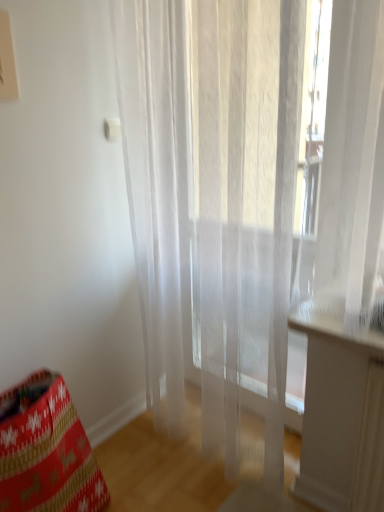
Question: Is red knit bean bag chair at lower left to the left of transparent fabric curtain at center from the viewer's perspective?

Choices:
 (A) yes
 (B) no

Answer: (A)

Question: Considering the relative sizes of red knit bean bag chair at lower left and transparent fabric curtain at center in the image provided, is red knit bean bag chair at lower left wider than transparent fabric curtain at center?

Choices:
 (A) yes
 (B) no

Answer: (A)

Question: Considering the relative sizes of red knit bean bag chair at lower left and transparent fabric curtain at center in the image provided, is red knit bean bag chair at lower left taller than transparent fabric curtain at center?

Choices:
 (A) no
 (B) yes

Answer: (A)

Question: Does red knit bean bag chair at lower left contain transparent fabric curtain at center?

Choices:
 (A) yes
 (B) no

Answer: (B)

Question: From a real-world perspective, is red knit bean bag chair at lower left beneath transparent fabric curtain at center?

Choices:
 (A) no
 (B) yes

Answer: (B)

Question: Can you see red knit bean bag chair at lower left touching transparent fabric curtain at center?

Choices:
 (A) yes
 (B) no

Answer: (B)

Question: Considering the relative positions of transparent fabric curtain at center and red knit bean bag chair at lower left in the image provided, is transparent fabric curtain at center to the right of red knit bean bag chair at lower left from the viewer's perspective?

Choices:
 (A) yes
 (B) no

Answer: (A)

Question: Does transparent fabric curtain at center have a greater width compared to red knit bean bag chair at lower left?

Choices:
 (A) yes
 (B) no

Answer: (B)

Question: Can you confirm if transparent fabric curtain at center is bigger than red knit bean bag chair at lower left?

Choices:
 (A) yes
 (B) no

Answer: (A)

Question: Can you confirm if transparent fabric curtain at center is shorter than red knit bean bag chair at lower left?

Choices:
 (A) no
 (B) yes

Answer: (A)

Question: From a real-world perspective, does transparent fabric curtain at center sit lower than red knit bean bag chair at lower left?

Choices:
 (A) no
 (B) yes

Answer: (A)

Question: Is transparent fabric curtain at center far away from red knit bean bag chair at lower left?

Choices:
 (A) yes
 (B) no

Answer: (B)

Question: Is red knit bean bag chair at lower left wider or thinner than transparent fabric curtain at center?

Choices:
 (A) thin
 (B) wide

Answer: (B)